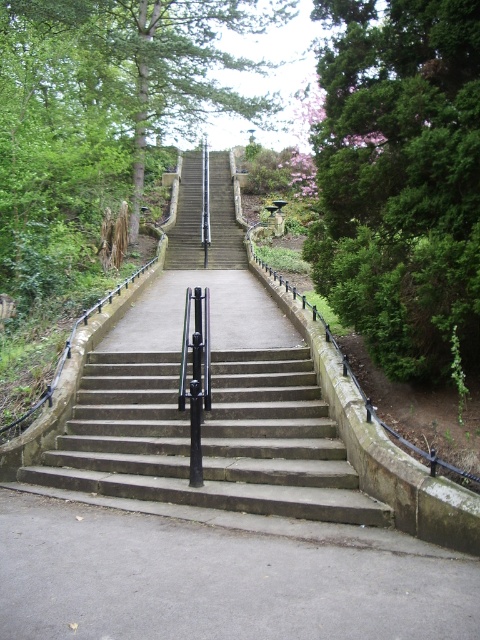
You are standing at the bottom of the stone steps and want to take a photo of the green leafy tree at upper left and the concrete stairs at center. Which object will appear larger in the photo?

The green leafy tree at upper left will appear larger in the photo because it is much taller than the concrete stairs at center.

You are standing at the bottom of the stone steps and want to take a photo of the green leafy tree at right and the concrete stairs at center. Which object should you zoom in on more to ensure both are visible in the frame?

The green leafy tree at right is taller than the concrete stairs at center, so you should zoom in more on the green leafy tree at right to ensure both are visible in the frame.